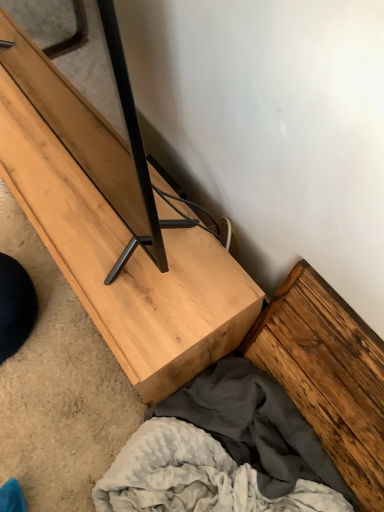
Question: Relative to natural wood tv stand at center, is wooden plank at lower right, arranged as the first plank when viewed from the right, in front or behind?

Choices:
 (A) front
 (B) behind

Answer: (A)

Question: Is point (347, 371) closer or farther from the camera than point (57, 242)?

Choices:
 (A) farther
 (B) closer

Answer: (B)

Question: Which is nearer to the wooden plank at lower right, acting as the second plank starting from the left?

Choices:
 (A) natural wood tv stand at center
 (B) black matte wood plank at center, placed as the second plank when sorted from bottom to top

Answer: (A)

Question: Estimate the real-world distances between objects in this image. Which object is farther from the black matte wood plank at center, arranged as the first plank when viewed from the left?

Choices:
 (A) natural wood tv stand at center
 (B) wooden plank at lower right, acting as the second plank starting from the left

Answer: (B)